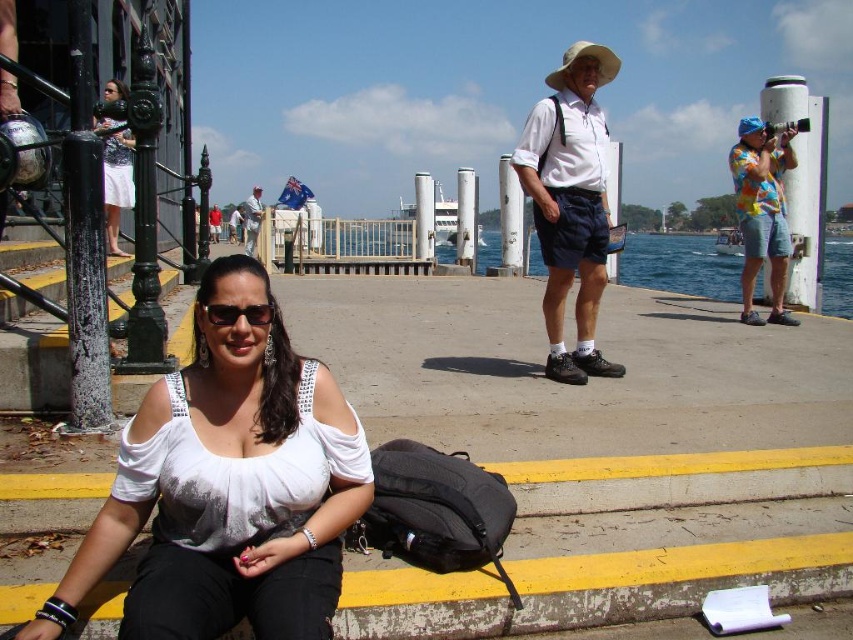
Question: Does white fabric cowboy hat at upper center come in front of white cotton shirt at center?

Choices:
 (A) yes
 (B) no

Answer: (A)

Question: Can you confirm if matte black dress at upper left is bigger than black reflective sunglasses at center?

Choices:
 (A) no
 (B) yes

Answer: (B)

Question: Estimate the real-world distances between objects in this image. Which object is closer to the matte black dress at upper left?

Choices:
 (A) white matte blouse at lower left
 (B) white matte shirt at center
 (C) white cotton shirt at center
 (D) white fabric cowboy hat at upper center

Answer: (B)

Question: Which object is positioned closest to the white matte shirt at center?

Choices:
 (A) multicolored fabric shirt at right
 (B) white matte blouse at lower left
 (C) blue water at center

Answer: (A)

Question: Which point is closer to the camera?

Choices:
 (A) (560, 136)
 (B) (628, 276)

Answer: (A)

Question: Does multicolored fabric shirt at right appear on the left side of white fabric cowboy hat at upper center?

Choices:
 (A) no
 (B) yes

Answer: (B)